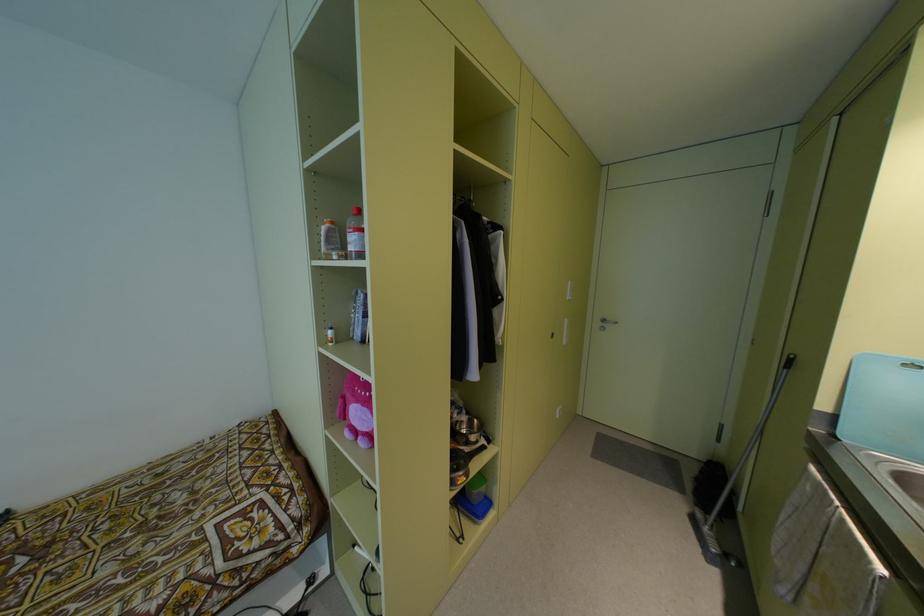
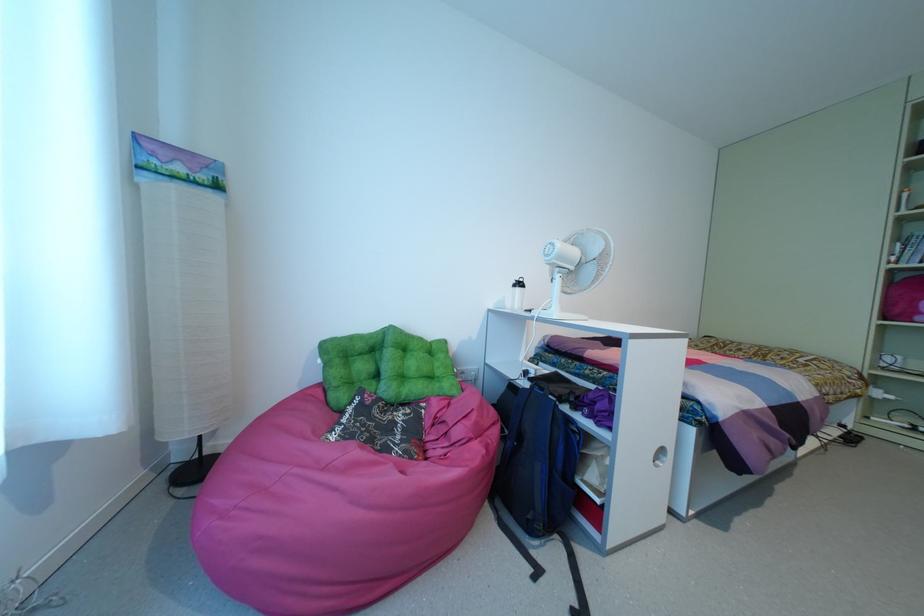
The images are taken continuously from a first-person perspective. In which direction are you moving?

The cameraman moved toward left, backward.